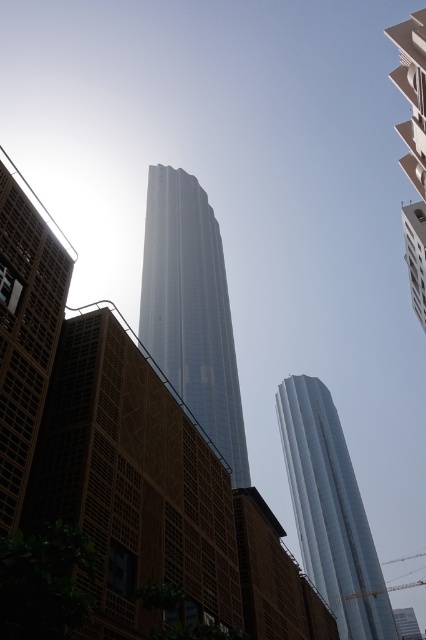
From the picture: Does brown textured wall at left have a greater height compared to white glossy building at upper right?

In fact, brown textured wall at left may be shorter than white glossy building at upper right.

Can you confirm if brown textured wall at left is smaller than white glossy building at upper right?

Indeed, brown textured wall at left has a smaller size compared to white glossy building at upper right.

Who is more forward, (28, 352) or (419, 205)?

Positioned in front is point (28, 352).

Image resolution: width=426 pixels, height=640 pixels. In order to click on brown textured wall at left in this screenshot , I will do `click(25, 328)`.

Can you confirm if silver metallic tower at center is positioned to the left of white glossy building at upper right?

No, silver metallic tower at center is not to the left of white glossy building at upper right.

The image size is (426, 640). What are the coordinates of `silver metallic tower at center` in the screenshot? It's located at (331, 509).

This screenshot has height=640, width=426. I want to click on silver metallic tower at center, so click(331, 509).

Does point (420, 232) come closer to viewer compared to point (408, 272)?

Yes, point (420, 232) is in front of point (408, 272).

Is point (403, 166) less distant than point (411, 268)?

Yes, point (403, 166) is in front of point (411, 268).

This screenshot has height=640, width=426. Find the location of `white glossy building at upper right`. white glossy building at upper right is located at coordinates (414, 145).